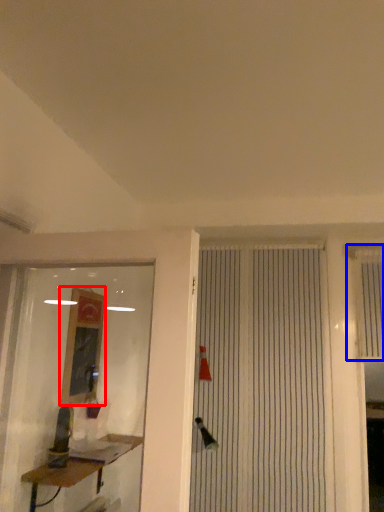
Question: Which of the following is the farthest to the observer, job (highlighted by a red box) or shutter (highlighted by a blue box)?

Choices:
 (A) job
 (B) shutter

Answer: (B)